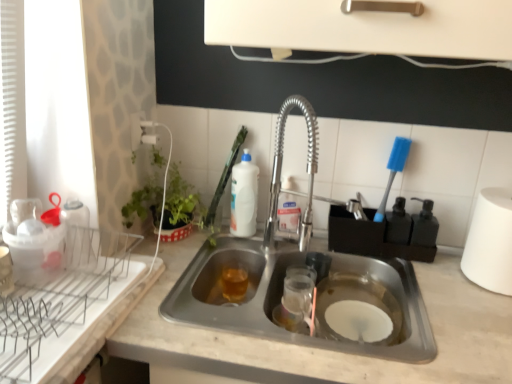
Question: Is white marble countertop at center inside or outside of white glossy bottle at upper center, arranged as the first beverage when viewed from the top?

Choices:
 (A) inside
 (B) outside

Answer: (B)

Question: Considering the positions of white marble countertop at center and white glossy bottle at upper center, the second beverage positioned from the bottom, in the image, is white marble countertop at center bigger or smaller than white glossy bottle at upper center, the second beverage positioned from the bottom,?

Choices:
 (A) big
 (B) small

Answer: (A)

Question: Which object is positioned farthest from the translucent amber liquid at sink bottom, which ranks as the 2th beverage in top-to-bottom order?

Choices:
 (A) white marble countertop at center
 (B) white plastic brush at upper center
 (C) white matte paper towel at right
 (D) white glossy bottle at upper center, the second beverage positioned from the bottom

Answer: (C)

Question: Which is nearer to the translucent amber liquid at sink bottom, the 1th beverage in the bottom-to-top sequence?

Choices:
 (A) white marble countertop at center
 (B) white glossy bottle at upper center, the second beverage positioned from the bottom
 (C) white plastic brush at upper center
 (D) white matte paper towel at right

Answer: (B)